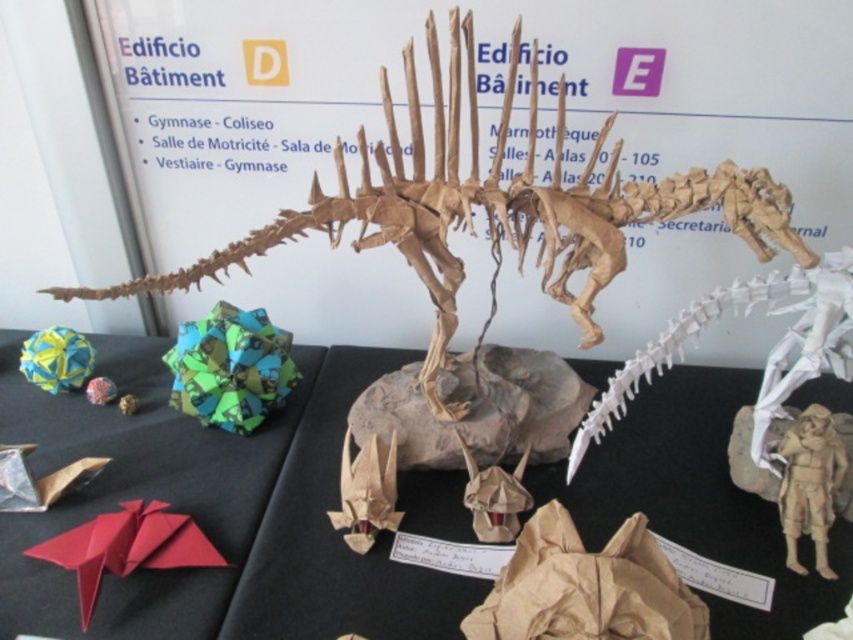
You are an artist trying to place a new origami piece on the table. You have a small white paper spine at center and a black paper at center. Which one occupies more space on the table?

The black paper at center has a larger size compared to the white paper spine at center, so it occupies more space on the table.

You are an art curator examining the origami display. You need to determine the spatial relationship between the brown paper dinosaur at center and the white paper spine at center. Which object is positioned closer to the observer?

The brown paper dinosaur at center is closer to the viewer than the white paper spine at center.

You are an art curator examining the origami display. You need to determine which object is taller between the black paper at center and the brown paper dinosaur at center. Based on the scene, which one is taller?

The brown paper dinosaur at center is taller than the black paper at center.